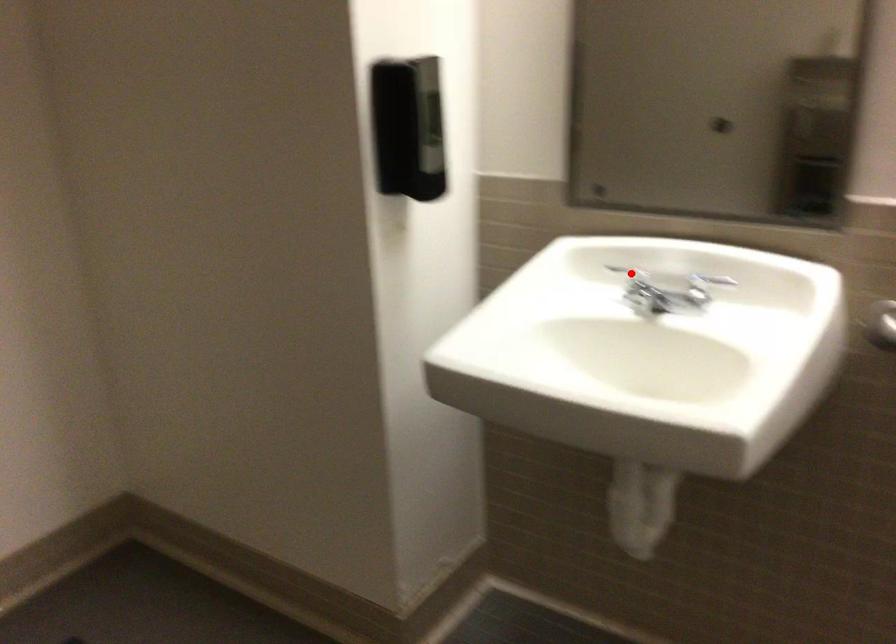
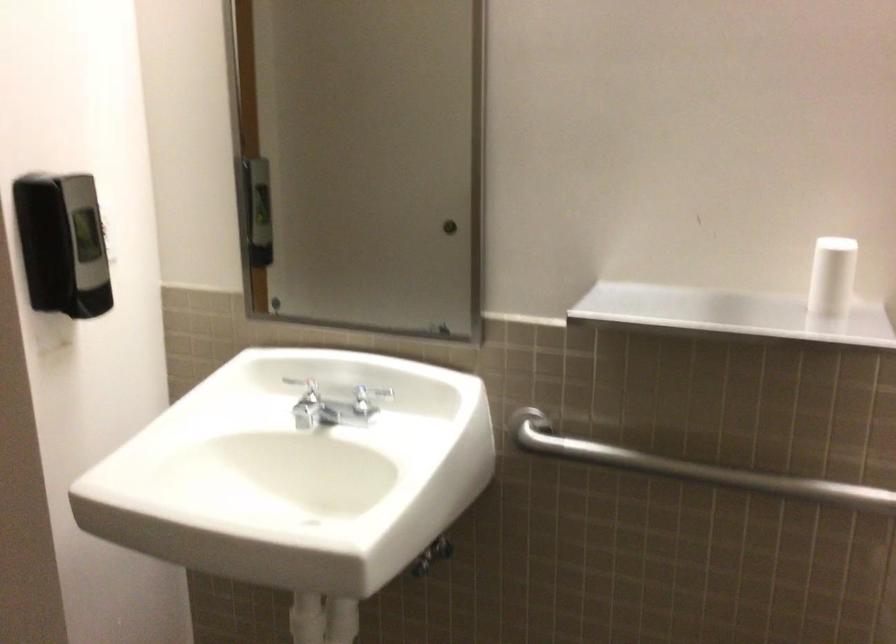
Locate, in the second image, the point that corresponds to the highlighted location in the first image.

(305, 389)